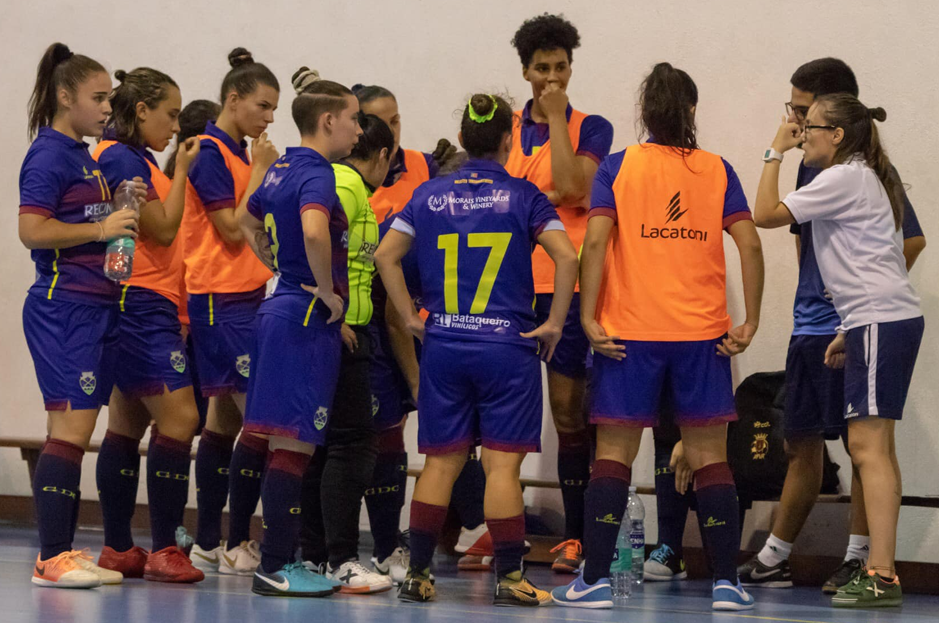
Locate an element on the screen. white wall is located at coordinates (127, 27), (724, 17), (916, 65).